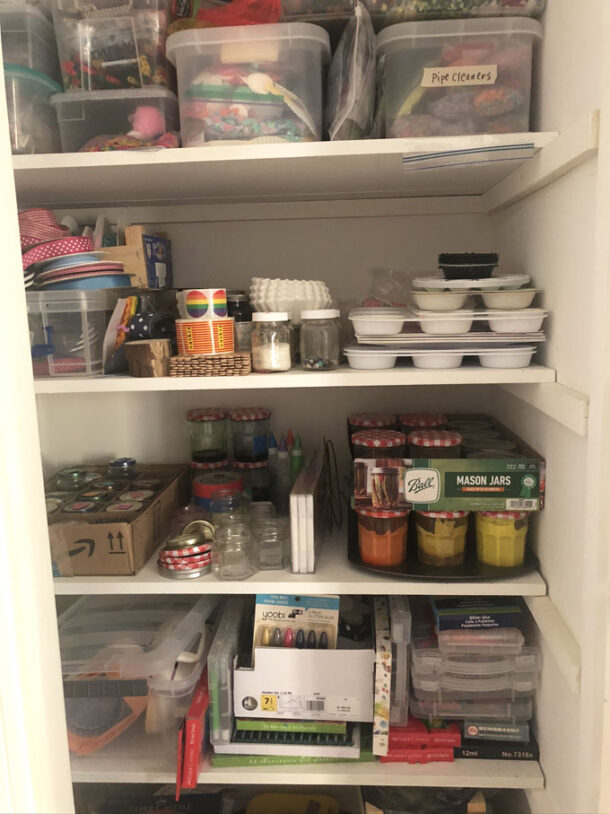
Find the location of `box`. box is located at coordinates (252, 689), (127, 549), (456, 476).